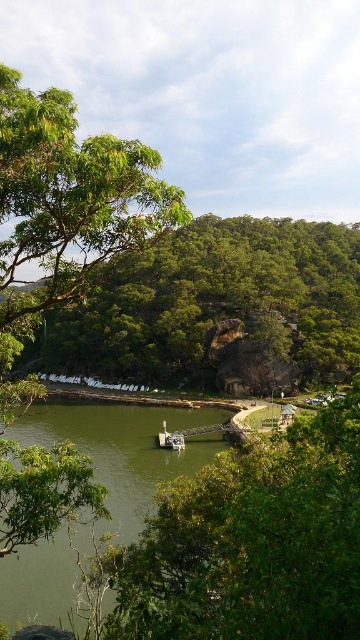
Question: Which of the following is the farthest from the observer?

Choices:
 (A) green smooth water at center
 (B) green leafy tree at lower center

Answer: (A)

Question: Does green smooth water at center come in front of metallic silver boat at center?

Choices:
 (A) no
 (B) yes

Answer: (B)

Question: Which point is closer to the camera?

Choices:
 (A) green leafy tree at upper left
 (B) green leafy tree at lower center
 (C) green leafy tree at left

Answer: (B)

Question: Does green smooth water at center have a smaller size compared to metallic silver boat at center?

Choices:
 (A) yes
 (B) no

Answer: (B)

Question: In this image, where is green leafy tree at lower center located relative to green leafy tree at left?

Choices:
 (A) below
 (B) above

Answer: (A)

Question: Which object is the farthest from the green leafy tree at left?

Choices:
 (A) green leafy tree at upper left
 (B) green smooth water at center
 (C) metallic silver boat at center

Answer: (A)